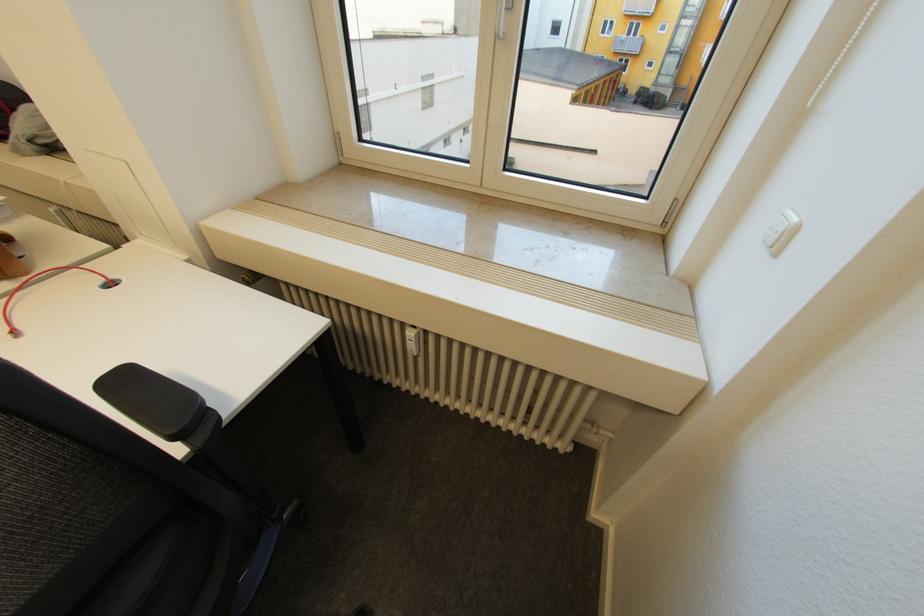
Locate an element on the screen. This screenshot has width=924, height=616. black chair armrest is located at coordinates (140, 397).